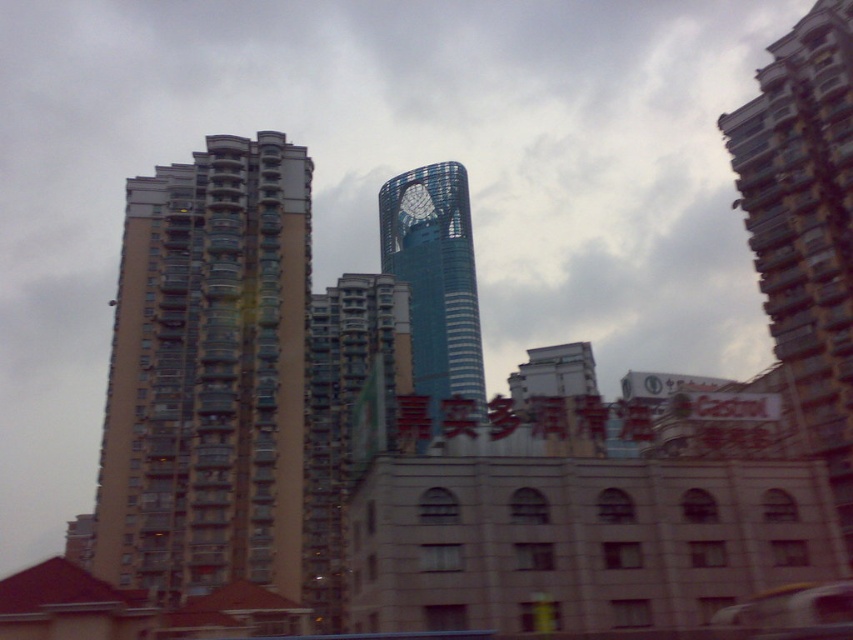
You are standing on the sidewalk in front of the beige concrete building at left and want to see the blue glassy tower at center. Can you see it without moving your head?

The blue glassy tower at center is behind the beige concrete building at left, so you cannot see it without moving your head.

You are standing at the base of the central skyscraper and want to take a photo of the point marked at coordinates (122, 280). If your camera has a maximum focus range of 300 feet, will you be able to capture the point clearly?

The distance of point (122, 280) from camera is 307.60 feet, which exceeds the camera maximum focus range of 300 feet. Therefore, you won not be able to capture the point clearly.

You are an architect analyzing the urban layout. Based on the scene, which object is located below the other between the beige concrete building at left and the blue glassy tower at center?

The beige concrete building at left is positioned under the blue glassy tower at center, meaning it is located below the blue glassy tower at center.